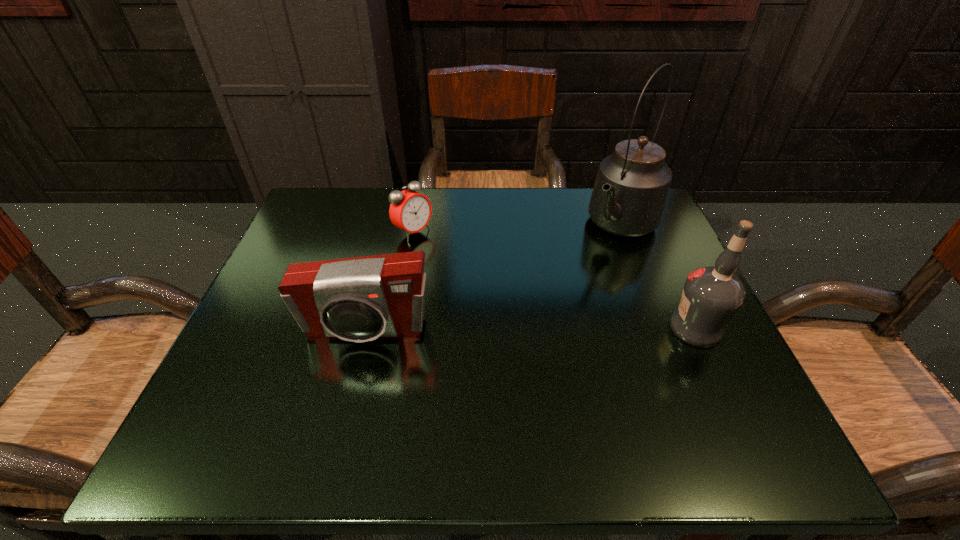
The image size is (960, 540). Identify the location of the second shortest object. (359, 299).

Locate an element on the screen. The width and height of the screenshot is (960, 540). the third shortest object is located at coordinates (711, 296).

The height and width of the screenshot is (540, 960). Find the location of `alarm clock`. alarm clock is located at coordinates (410, 211).

Find the location of a particular element. kettle is located at coordinates [628, 199].

The image size is (960, 540). In order to click on blank space located on the front-facing side of the camera in this screenshot , I will do `click(350, 388)`.

The width and height of the screenshot is (960, 540). What are the coordinates of `vacant space situated on the front label of the third shortest object` in the screenshot? It's located at (612, 328).

The height and width of the screenshot is (540, 960). Identify the location of vacant space located on the front label of the third shortest object. (617, 328).

The width and height of the screenshot is (960, 540). I want to click on free spot located on the front label of the third shortest object, so click(507, 328).

You are a GUI agent. You are given a task and a screenshot of the screen. Output one action in this format:
    pyautogui.click(x=<x>, y=<y>)
    Task: Click on the blank space located on the front-facing side of the shortest object
    Image resolution: width=960 pixels, height=540 pixels.
    Given the screenshot: What is the action you would take?
    pyautogui.click(x=508, y=292)

Image resolution: width=960 pixels, height=540 pixels. What are the coordinates of `vacant space located on the front-facing side of the shortest object` in the screenshot? It's located at (536, 308).